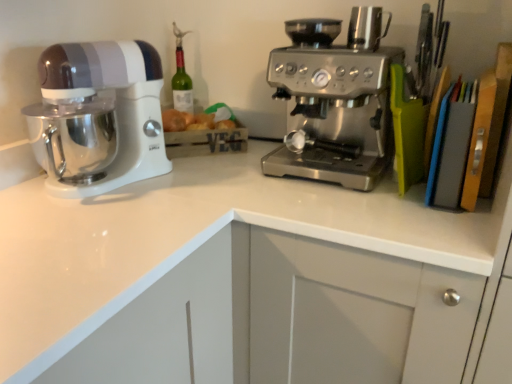
Question: Can you confirm if white glossy mixer at left is shorter than satin silver coffee maker at center?

Choices:
 (A) yes
 (B) no

Answer: (B)

Question: Does white glossy mixer at left have a smaller size compared to satin silver coffee maker at center?

Choices:
 (A) yes
 (B) no

Answer: (A)

Question: Is white glossy mixer at left outside of satin silver coffee maker at center?

Choices:
 (A) yes
 (B) no

Answer: (A)

Question: From the image's perspective, is white glossy mixer at left on top of satin silver coffee maker at center?

Choices:
 (A) no
 (B) yes

Answer: (A)

Question: Can you confirm if white glossy mixer at left is thinner than satin silver coffee maker at center?

Choices:
 (A) yes
 (B) no

Answer: (A)

Question: Is white glossy mixer at left positioned with its back to satin silver coffee maker at center?

Choices:
 (A) no
 (B) yes

Answer: (A)

Question: Is stainless steel coffee maker at upper right turned away from white glossy countertop at center?

Choices:
 (A) yes
 (B) no

Answer: (B)

Question: Can you confirm if stainless steel coffee maker at upper right is positioned to the left of white glossy countertop at center?

Choices:
 (A) yes
 (B) no

Answer: (B)

Question: From the image's perspective, is stainless steel coffee maker at upper right over white glossy countertop at center?

Choices:
 (A) no
 (B) yes

Answer: (B)

Question: Is stainless steel coffee maker at upper right smaller than white glossy countertop at center?

Choices:
 (A) no
 (B) yes

Answer: (B)

Question: From a real-world perspective, is stainless steel coffee maker at upper right on white glossy countertop at center?

Choices:
 (A) yes
 (B) no

Answer: (A)

Question: Is white glossy countertop at center surrounded by stainless steel coffee maker at upper right?

Choices:
 (A) yes
 (B) no

Answer: (B)

Question: Could you tell me if white glossy countertop at center is facing stainless steel coffee maker at upper right?

Choices:
 (A) no
 (B) yes

Answer: (A)